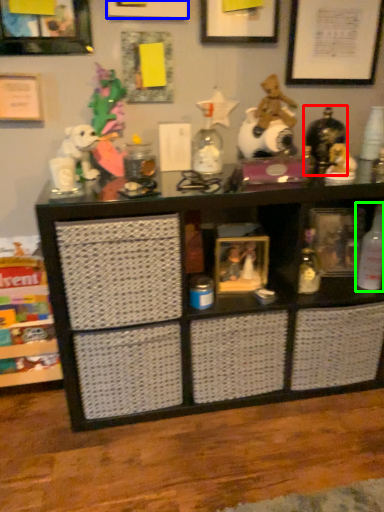
Question: Considering the real-world distances, which object is farthest from toy (highlighted by a red box)? picture frame (highlighted by a blue box) or bottle (highlighted by a green box)?

Choices:
 (A) picture frame
 (B) bottle

Answer: (A)